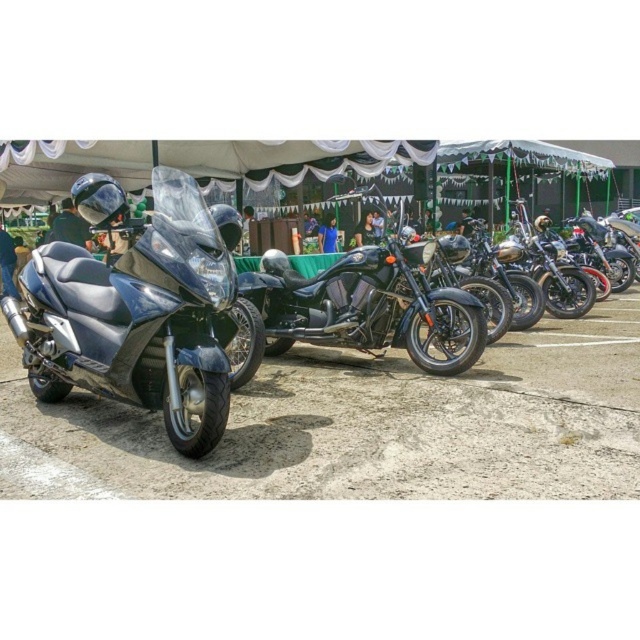
You are planning to transport both the matte black scooter at left and the glossy black motorcycle at center using a trailer that can only accommodate one vehicle at a time. Based on their sizes, which vehicle should you load first onto the trailer to ensure it fits properly?

The glossy black motorcycle at center should be loaded first onto the trailer because it is smaller than the matte black scooter at left, allowing it to fit more easily before the larger scooter takes up more space.

You are a photographer setting up a tripod to take a photo of the matte black scooter at left and the glossy black motorcycle at center. If you want to capture both vehicles in the same frame without moving the tripod, which vehicle should you position closer to the camera to ensure both appear balanced in size?

The matte black scooter at left is much taller than the glossy black motorcycle at center. To balance their sizes in the photo, position the glossy black motorcycle at center closer to the camera since it is shorter, allowing it to appear larger in the frame, while the taller scooter can be placed farther back to reduce its apparent size.

You are a photographer standing at the edge of the tent. You want to take a photo of both the glossy black motorcycle at center and the shiny chrome motorcycle at center. If your camera can capture objects within a 4 meter range, will both motorcycles fit in the photo?

The glossy black motorcycle at center is 3.62 meters away from the shiny chrome motorcycle at center. Since the distance between them is less than 4 meters, both motorcycles will fit within the camera range and appear in the photo.